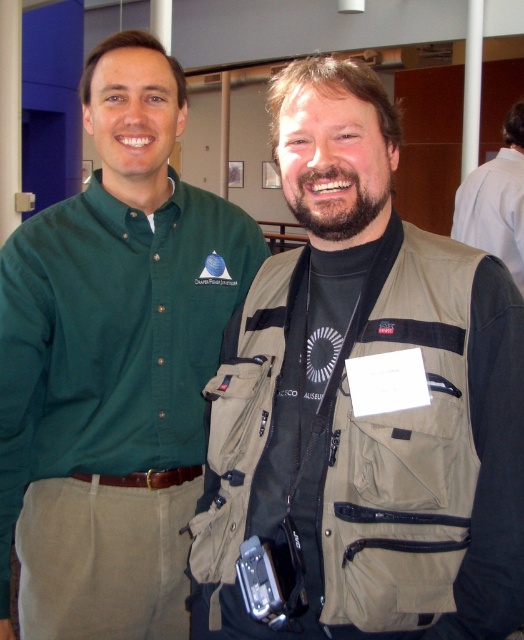
Question: Can you confirm if khaki fabric vest at center is positioned to the right of green button-down shirt at left?

Choices:
 (A) no
 (B) yes

Answer: (B)

Question: Among these points, which one is nearest to the camera?

Choices:
 (A) (331, 60)
 (B) (159, 234)
 (C) (522, 211)

Answer: (A)

Question: Is khaki fabric vest at center in front of white shirt at upper right?

Choices:
 (A) no
 (B) yes

Answer: (B)

Question: From the image, what is the correct spatial relationship of green button-down shirt at left in relation to white shirt at upper right?

Choices:
 (A) below
 (B) above

Answer: (A)

Question: Among these points, which one is farthest from the camera?

Choices:
 (A) (315, 371)
 (B) (507, 132)
 (C) (166, 202)

Answer: (B)

Question: Which point is farther to the camera?

Choices:
 (A) white shirt at upper right
 (B) khaki fabric vest at center

Answer: (A)